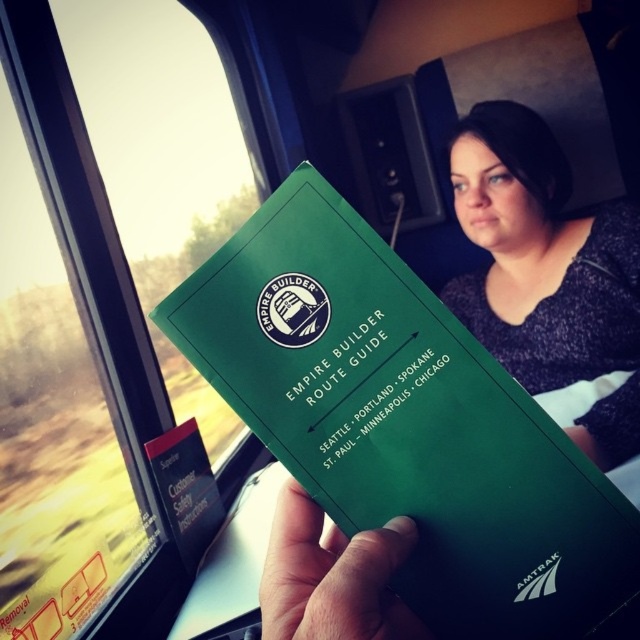
Question: Which point is farther from the camera taking this photo?

Choices:
 (A) (442, 406)
 (B) (275, 632)

Answer: (A)

Question: Which point appears closest to the camera in this image?

Choices:
 (A) (403, 276)
 (B) (384, 611)
 (C) (1, 164)

Answer: (B)

Question: Which of the following is the farthest from the observer?

Choices:
 (A) (397, 600)
 (B) (45, 362)
 (C) (310, 209)

Answer: (B)

Question: Can you confirm if transparent glass train window at left is positioned to the left of green matte paper at center?

Choices:
 (A) no
 (B) yes

Answer: (B)

Question: Does green paper at center appear under green matte paper at center?

Choices:
 (A) yes
 (B) no

Answer: (B)

Question: Is green paper at center in front of green matte paper at center?

Choices:
 (A) no
 (B) yes

Answer: (A)